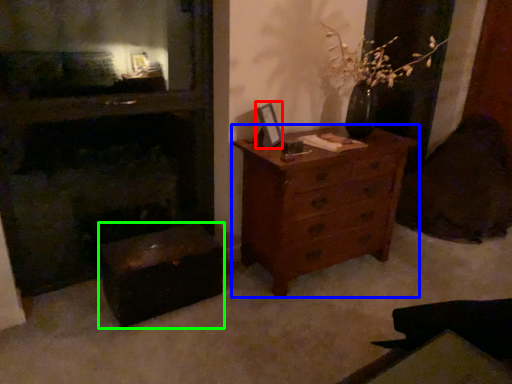
Question: Considering the real-world distances, which object is closest to picture frame (highlighted by a red box)? chest of drawers (highlighted by a blue box) or vanity (highlighted by a green box).

Choices:
 (A) chest of drawers
 (B) vanity

Answer: (A)